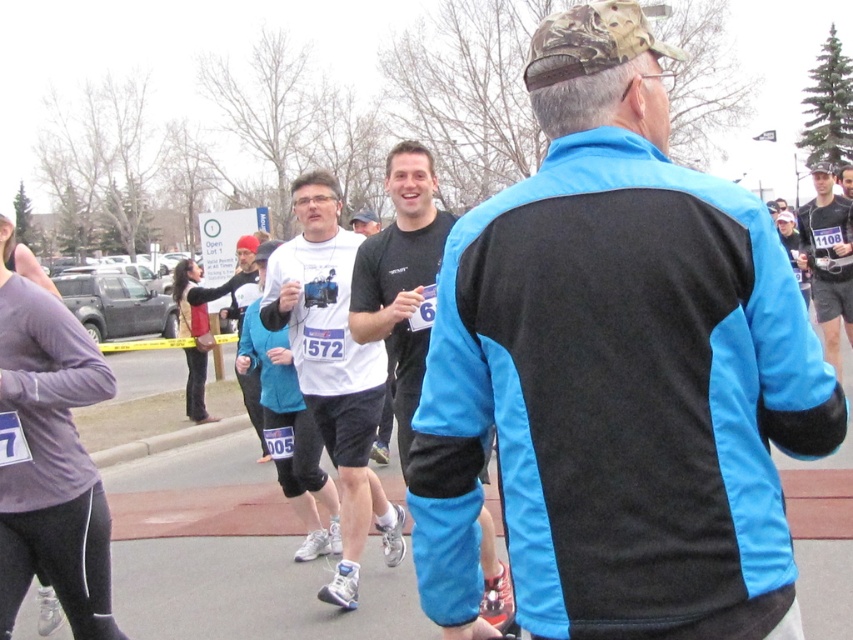
Consider the image. Between blue/black jacket at center and purple matte running shirt at lower left, which one has more height?

purple matte running shirt at lower left

Is blue/black jacket at center taller than purple matte running shirt at lower left?

Incorrect, blue/black jacket at center's height is not larger of purple matte running shirt at lower left's.

Is point (651, 145) positioned in front of point (12, 611)?

Yes.

Identify the location of blue/black jacket at center. (616, 372).

Measure the distance from purple matte running shirt at lower left to black matte shirt at center.

purple matte running shirt at lower left and black matte shirt at center are 1.54 meters apart from each other.

Does point (27, 296) lie behind point (363, 291)?

No, it is in front of (363, 291).

Measure the distance between point (x=70, y=324) and camera.

10.31 feet

Find the location of a particular element. This screenshot has height=640, width=853. purple matte running shirt at lower left is located at coordinates (50, 458).

Between point (329, 339) and point (412, 268), which one is positioned in front?

Point (412, 268) is in front.

In the scene shown: Does white matte t-shirt at center come in front of black matte shirt at center?

No, white matte t-shirt at center is behind black matte shirt at center.

Which is in front, point (372, 422) or point (425, 353)?

Positioned in front is point (425, 353).

Image resolution: width=853 pixels, height=640 pixels. In order to click on white matte t-shirt at center in this screenshot , I will do `click(334, 369)`.